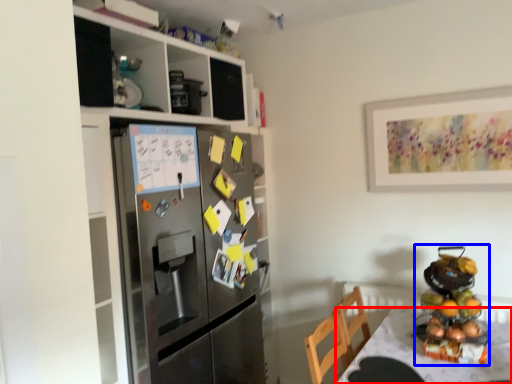
Question: Which of the following is the closest to the observer, desk (highlighted by a red box) or appliance (highlighted by a blue box)?

Choices:
 (A) desk
 (B) appliance

Answer: (A)